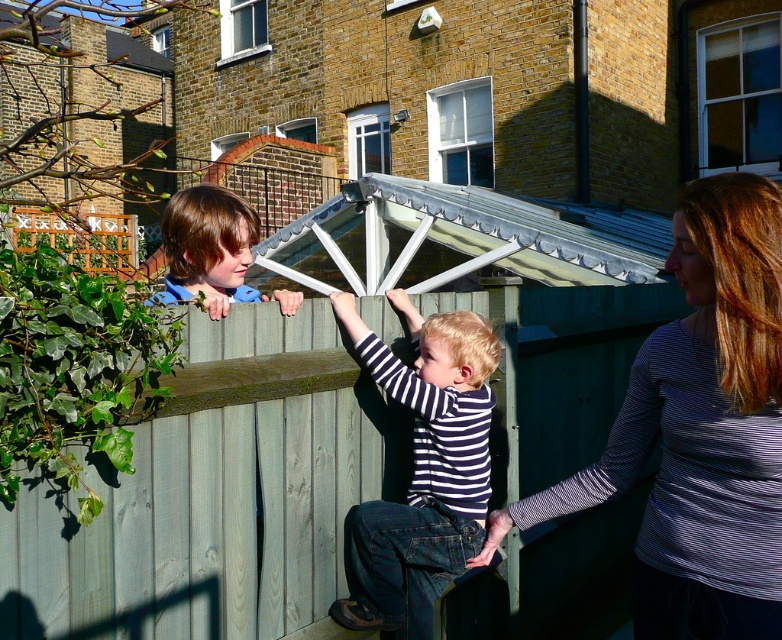
Based on the coordinates provided, which object is located at point (700, 429) in the image?

The point (700, 429) marks the location of the striped long sleeve shirt at center.